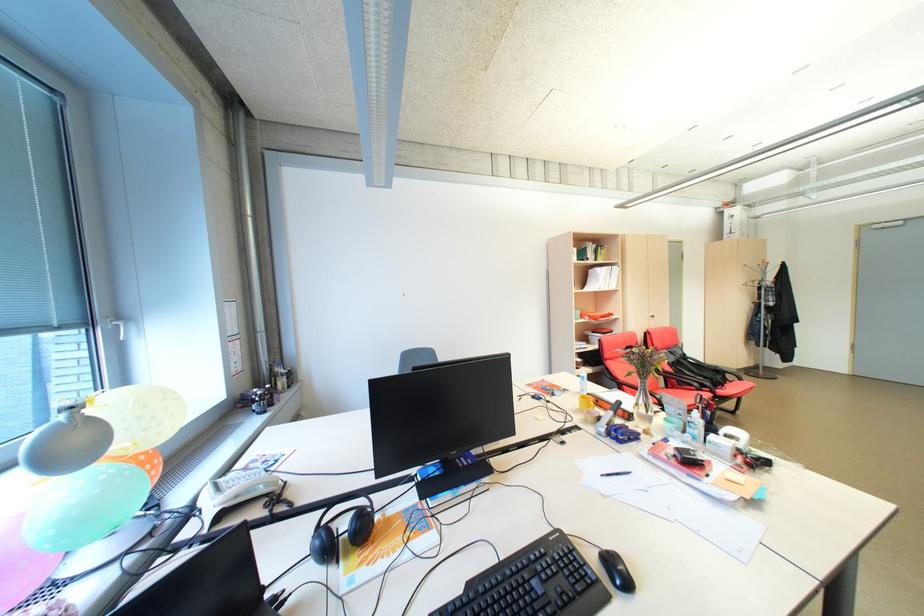
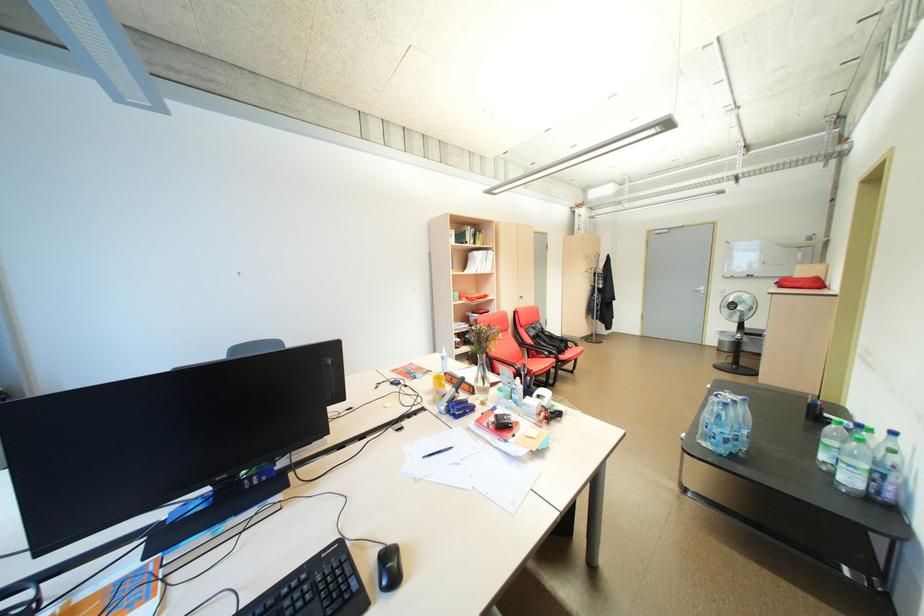
Question: Which direction would the cameraman need to move to produce the second image? Reply with the corresponding letter.

Choices:
 (A) Left
 (B) Right
 (C) Forward
 (D) Backward

Answer: (B)